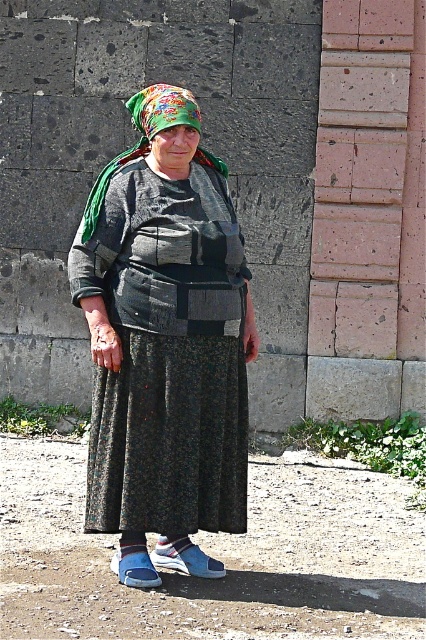
How distant is dark gray textured sweater at center from floral fabric headscarf at center?

They are 24.59 inches apart.

Which is in front, point (137, 241) or point (180, 108)?

Point (137, 241)

Find the location of a particular element. dark gray textured sweater at center is located at coordinates (164, 342).